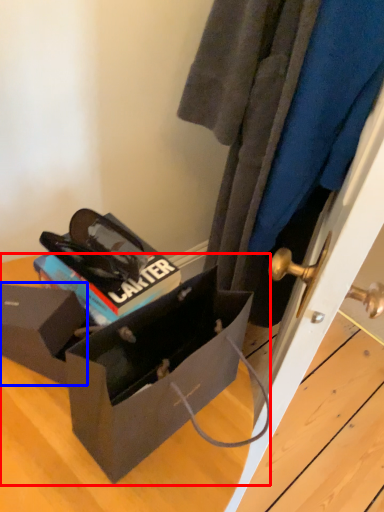
Question: Which of the following is the farthest to the observer, box (highlighted by a red box) or box (highlighted by a blue box)?

Choices:
 (A) box
 (B) box

Answer: (B)